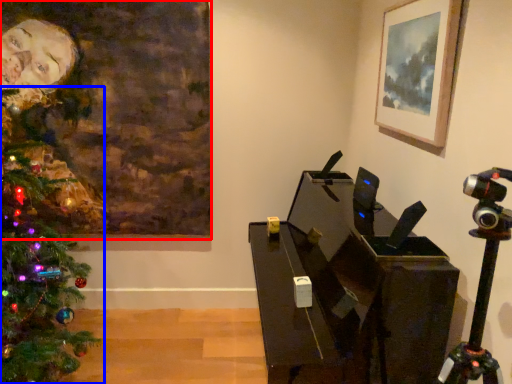
Question: Which object appears farthest to the camera in this image, picture frame (highlighted by a red box) or christmas tree (highlighted by a blue box)?

Choices:
 (A) picture frame
 (B) christmas tree

Answer: (A)